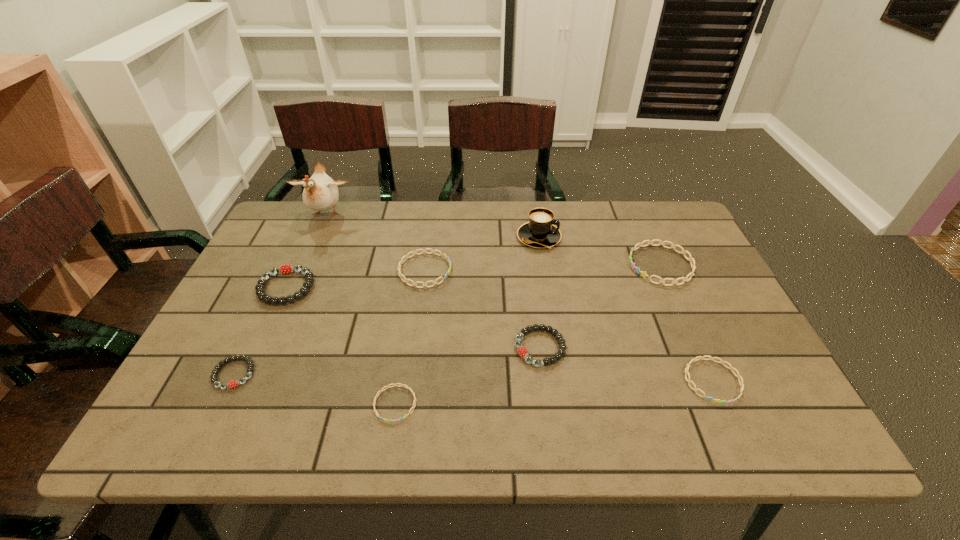
Find the location of a particular element. the smallest black bracelet is located at coordinates (232, 384).

You are a GUI agent. You are given a task and a screenshot of the screen. Output one action in this format:
    pyautogui.click(x=<x>, y=<y>)
    Task: Click on the shortest object
    This screenshot has height=540, width=960.
    Given the screenshot: What is the action you would take?
    pyautogui.click(x=401, y=385)

Find the location of `the smallest blue bracelet`. the smallest blue bracelet is located at coordinates (401, 385).

At what (x,y) coordinates should I click in order to perform the action: click on free region located at the beak of the bird. Please return your answer as a coordinate pair (x, y). This screenshot has height=540, width=960. Looking at the image, I should click on (304, 264).

Locate an element on the screen. The height and width of the screenshot is (540, 960). vacant region located on the left of the black cappuccino is located at coordinates (497, 237).

The height and width of the screenshot is (540, 960). Find the location of `vacant space located 0.400m on the surface of the biggest blue bracelet showing star-shaped elements`. vacant space located 0.400m on the surface of the biggest blue bracelet showing star-shaped elements is located at coordinates (488, 265).

Image resolution: width=960 pixels, height=540 pixels. I want to click on free location located on the surface of the biggest blue bracelet showing star-shaped elements, so click(x=506, y=265).

The width and height of the screenshot is (960, 540). Find the location of `vacant position located on the surface of the biggest blue bracelet showing star-shaped elements`. vacant position located on the surface of the biggest blue bracelet showing star-shaped elements is located at coordinates (608, 265).

At what (x,y) coordinates should I click in order to perform the action: click on free space located on the right of the biggest black bracelet. Please return your answer as a coordinate pair (x, y). Looking at the image, I should click on (407, 287).

Where is `free space located on the surface of the third smallest blue bracelet showing star-shaped elements`? The width and height of the screenshot is (960, 540). free space located on the surface of the third smallest blue bracelet showing star-shaped elements is located at coordinates (559, 270).